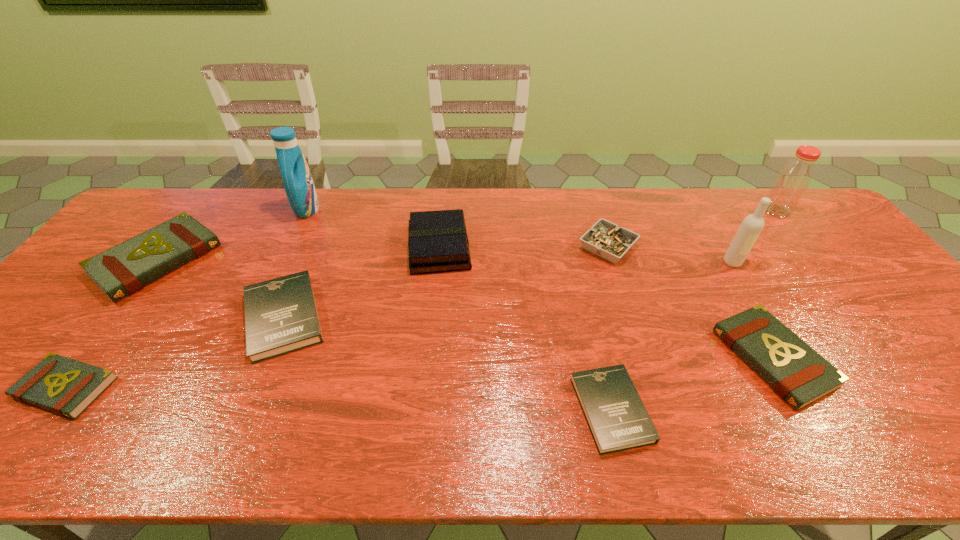
I want to click on the rightmost book, so click(797, 373).

Locate an element on the screen. Image resolution: width=960 pixels, height=540 pixels. the bigger dark book is located at coordinates (281, 316).

Locate an element on the screen. Image resolution: width=960 pixels, height=540 pixels. the left dark book is located at coordinates (281, 316).

This screenshot has width=960, height=540. Identify the location of the shortest object. (617, 418).

You are a GUI agent. You are given a task and a screenshot of the screen. Output one action in this format:
    pyautogui.click(x=<x>, y=<y>)
    Task: Click on the right dark book
    The image size is (960, 540).
    Given the screenshot: What is the action you would take?
    pyautogui.click(x=617, y=418)

The width and height of the screenshot is (960, 540). In order to click on free space located on the front-facing side of the tallest object in this screenshot , I will do `click(430, 209)`.

Image resolution: width=960 pixels, height=540 pixels. Identify the location of free space located 0.400m on the left of the red bottle. (641, 211).

I want to click on free space located on the back of the vodka, so click(x=712, y=228).

You are a GUI agent. You are given a task and a screenshot of the screen. Output one action in this format:
    pyautogui.click(x=<x>, y=<y>)
    Task: Click on the free point located on the back of the fourth book from left to right
    The height and width of the screenshot is (540, 960).
    Given the screenshot: What is the action you would take?
    pyautogui.click(x=444, y=201)

Where is `vacant space located on the front of the second tallest book`? vacant space located on the front of the second tallest book is located at coordinates (44, 409).